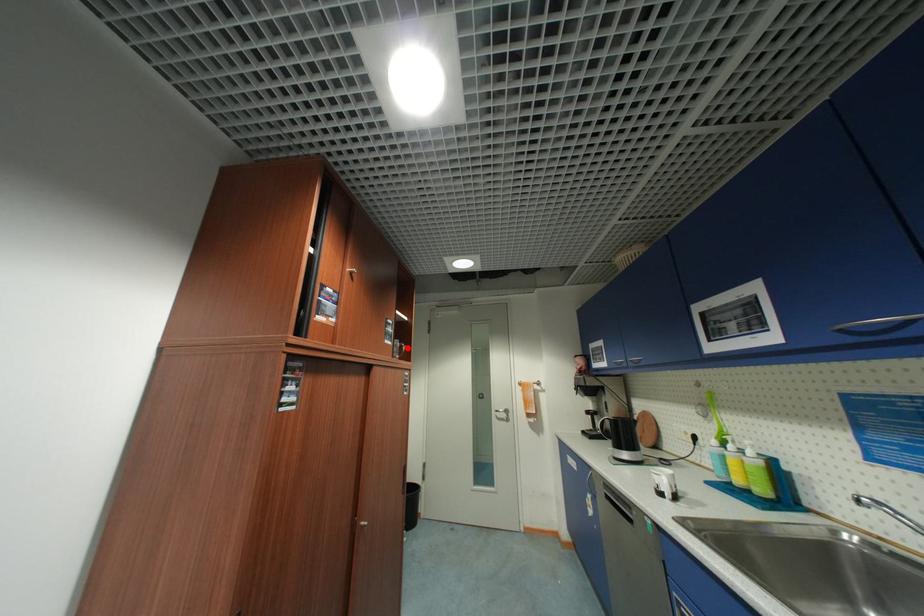
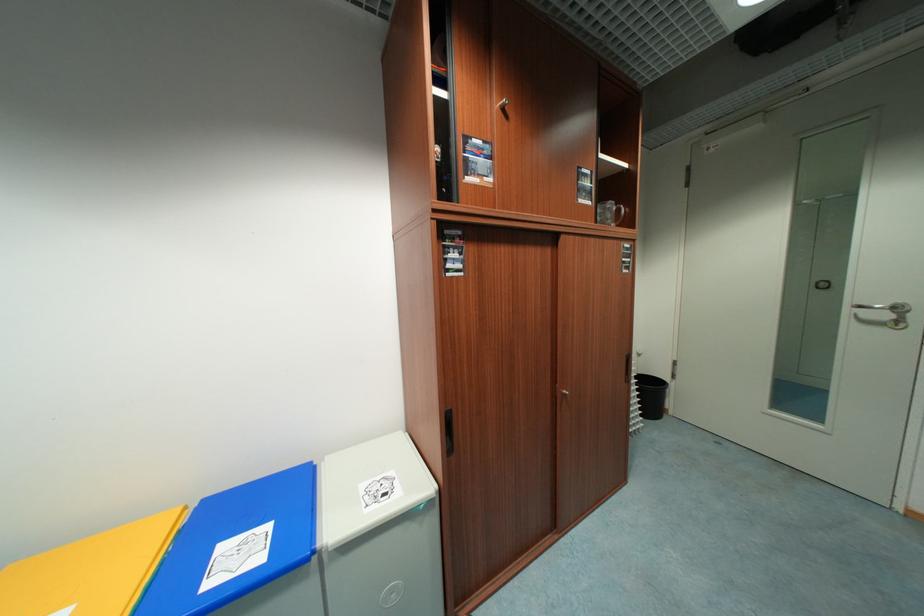
Question: I am providing you with two images of the same scene from different viewpoints. Given a red point in image1, look at the same physical point in image2. Is it:

Choices:
 (A) Closer to the viewpoint
 (B) Farther from the viewpoint

Answer: (A)